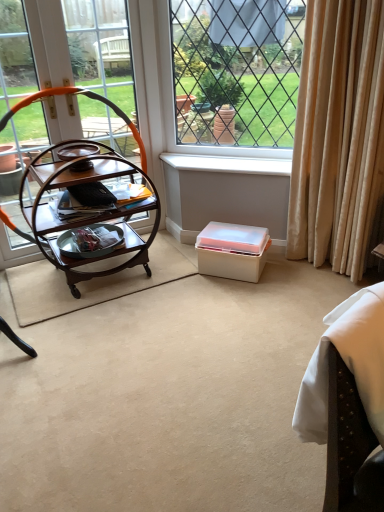
Question: Which is correct: metallic silver tray at center is inside beige velvet curtain at right, or outside of it?

Choices:
 (A) outside
 (B) inside

Answer: (A)

Question: Visually, is metallic silver tray at center positioned to the left or to the right of beige velvet curtain at right?

Choices:
 (A) right
 (B) left

Answer: (B)

Question: Which is farther from the metallic silver tray at center?

Choices:
 (A) white fabric swivel chair at lower right
 (B) white plastic box at center
 (C) beige velvet curtain at right
 (D) white plastic window sill at center
 (E) clear glass window at upper center

Answer: (A)

Question: Which object is positioned closest to the beige velvet curtain at right?

Choices:
 (A) white plastic window sill at center
 (B) clear glass window at upper center
 (C) white plastic box at center
 (D) wooden trolley at left
 (E) white fabric swivel chair at lower right

Answer: (A)